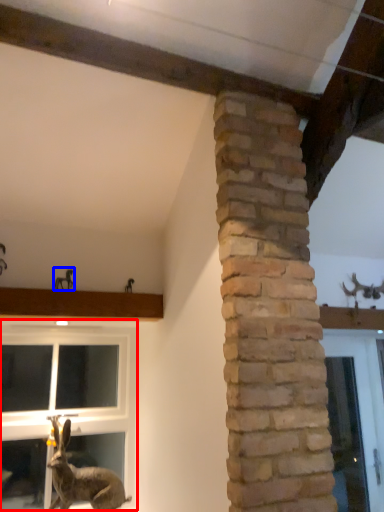
Question: Among these objects, which one is farthest to the camera, window (highlighted by a red box) or animal (highlighted by a blue box)?

Choices:
 (A) window
 (B) animal

Answer: (B)